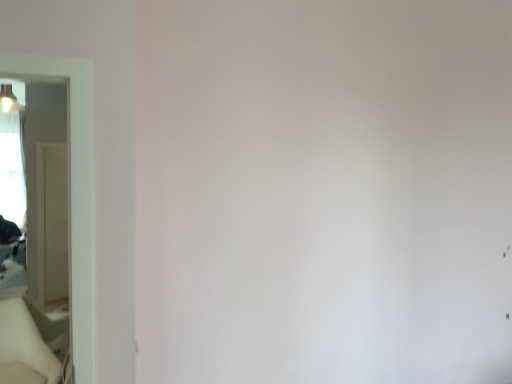
This screenshot has height=384, width=512. Identify the location of matte white mirror at left. (74, 192).

What do you see at coordinates (74, 192) in the screenshot? I see `matte white mirror at left` at bounding box center [74, 192].

The width and height of the screenshot is (512, 384). Identify the location of matte white mirror at left. (74, 192).